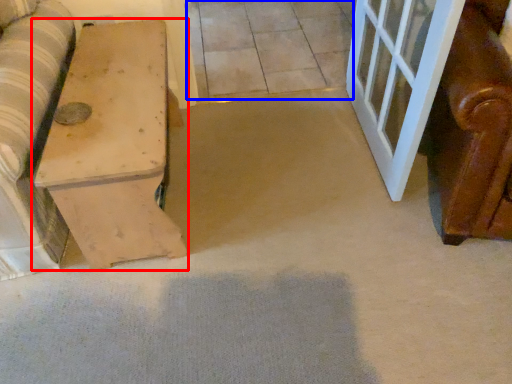
Question: Which object is closer to the camera taking this photo, furniture (highlighted by a red box) or tile (highlighted by a blue box)?

Choices:
 (A) furniture
 (B) tile

Answer: (A)